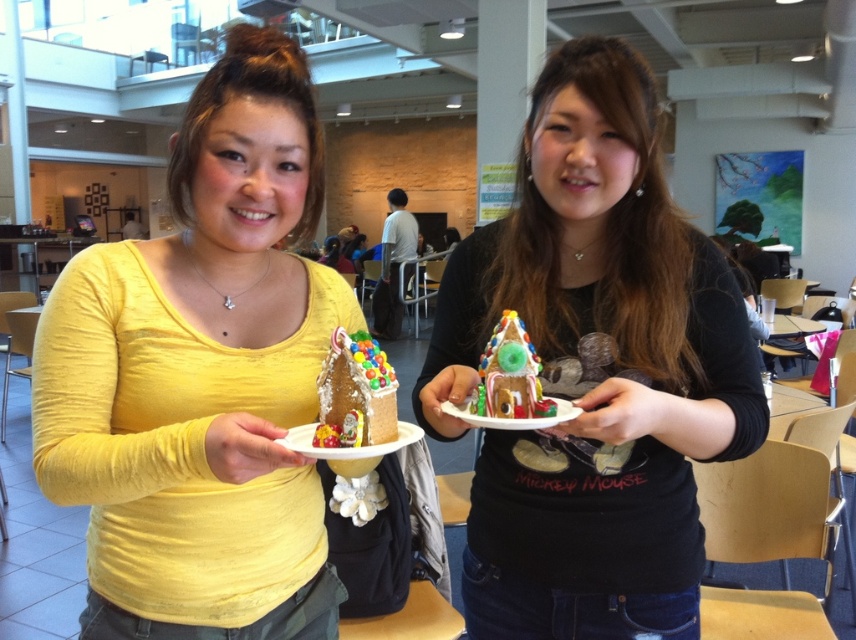
Where is `glossy gingerbread house at center`? Image resolution: width=856 pixels, height=640 pixels. glossy gingerbread house at center is located at coordinates (510, 374).

Who is shorter, glossy gingerbread house at center or matte gingerbread house at center?

With less height is matte gingerbread house at center.

Is point (516, 378) in front of point (342, 449)?

No, (516, 378) is behind (342, 449).

Identify the location of glossy gingerbread house at center. (510, 374).

Is yellow matte shirt at center positioned before matte gingerbread house at center?

No, it is behind matte gingerbread house at center.

Is yellow matte shirt at center below matte gingerbread house at center?

No.

Locate an element on the screen. yellow matte shirt at center is located at coordinates (201, 376).

Does matte brown gingerbread house at center have a lesser height compared to gingerbread house at center?

In fact, matte brown gingerbread house at center may be taller than gingerbread house at center.

Is matte brown gingerbread house at center thinner than gingerbread house at center?

Incorrect, matte brown gingerbread house at center's width is not less than gingerbread house at center's.

This screenshot has height=640, width=856. Describe the element at coordinates (593, 371) in the screenshot. I see `matte brown gingerbread house at center` at that location.

The image size is (856, 640). Find the location of `matte brown gingerbread house at center`. matte brown gingerbread house at center is located at coordinates (593, 371).